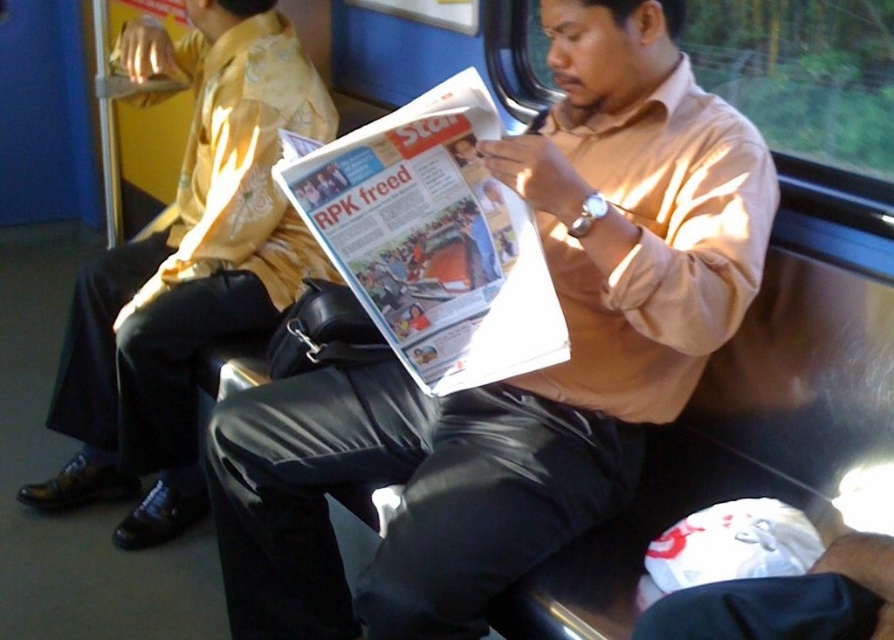
You are standing at the entrance of the train carriage and see the point marked at coordinates (521, 376). Which object is located at that point?

The point at coordinates (521, 376) corresponds to the matte brown shirt at center.

You are a passenger on the train and want to ask the person in the matte black pants at lower left a question. Can you easily approach them to speak without moving past the matte brown shirt at center?

The matte brown shirt at center is in front of the matte black pants at lower left, so you would need to move past the matte brown shirt at center to reach the matte black pants at lower left.

You are a photographer standing in the train carriage. You want to take a photo of the matte brown shirt at center and the white glossy newspaper at center. Which object should you focus on first if you want to ensure both are in focus without adjusting the camera settings?

The matte brown shirt at center is taller than the white glossy newspaper at center, so focusing on the matte brown shirt at center first would help ensure both are in focus since it is larger and closer to the camera.